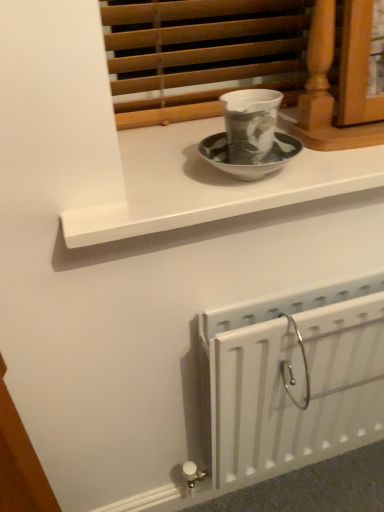
Question: In terms of height, does white glossy window sill at upper center look taller or shorter compared to white matte radiator at lower right?

Choices:
 (A) tall
 (B) short

Answer: (B)

Question: Does point (92, 217) appear closer or farther from the camera than point (340, 375)?

Choices:
 (A) farther
 (B) closer

Answer: (B)

Question: Is white glossy window sill at upper center inside or outside of white matte radiator at lower right?

Choices:
 (A) outside
 (B) inside

Answer: (A)

Question: Does point (263, 458) appear closer or farther from the camera than point (297, 167)?

Choices:
 (A) closer
 (B) farther

Answer: (B)

Question: From the image's perspective, is white matte radiator at lower right located above or below white glossy window sill at upper center?

Choices:
 (A) above
 (B) below

Answer: (B)

Question: Is white matte radiator at lower right taller or shorter than white glossy window sill at upper center?

Choices:
 (A) tall
 (B) short

Answer: (A)

Question: Is white matte radiator at lower right in front of or behind white glossy window sill at upper center in the image?

Choices:
 (A) behind
 (B) front

Answer: (A)